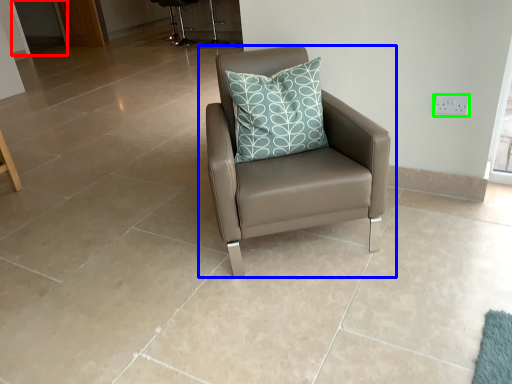
Question: Which object is the closest to the screen door (highlighted by a red box)? Choose among these: chair (highlighted by a blue box) or electric outlet (highlighted by a green box).

Choices:
 (A) chair
 (B) electric outlet

Answer: (A)